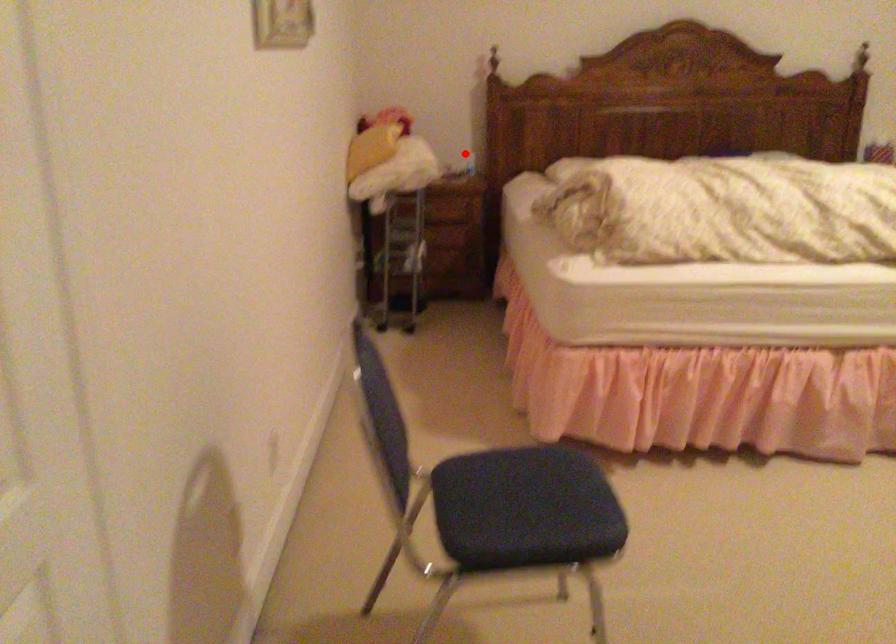
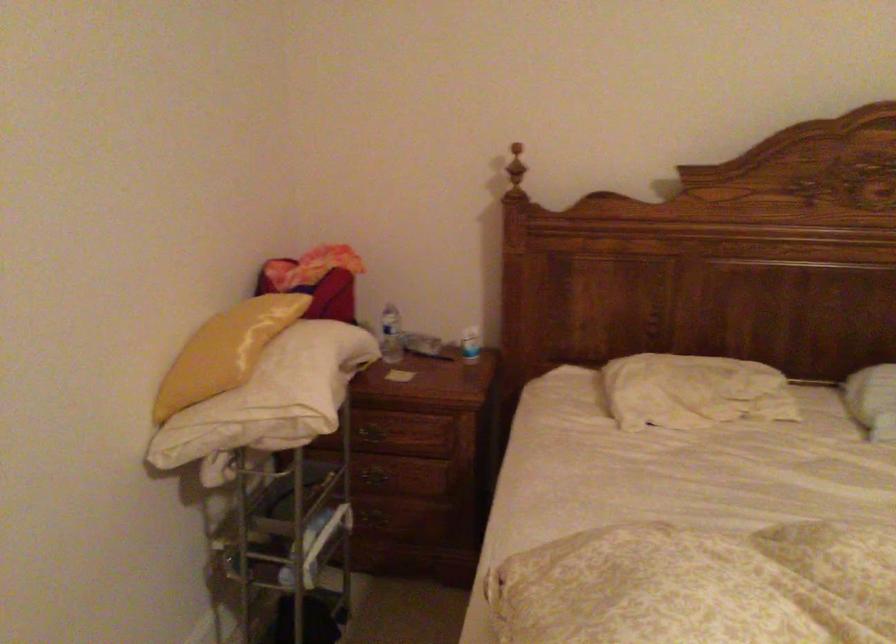
Question: I am providing you with two images of the same scene from different viewpoints. A red point is shown in image1. For the corresponding object point in image2, is it positioned nearer or farther from the camera?

Choices:
 (A) Nearer
 (B) Farther

Answer: (A)